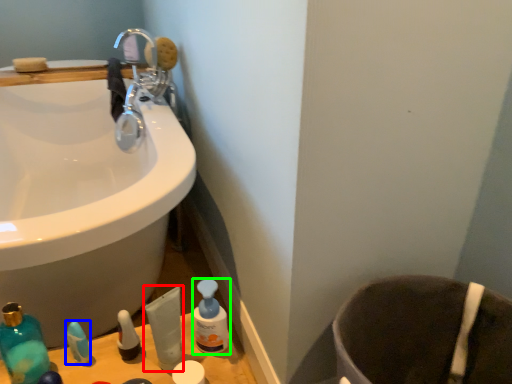
Question: Based on their relative distances, which object is nearer to toiletry (highlighted by a red box)? Choose from toiletry (highlighted by a blue box) and cleaning product (highlighted by a green box).

Choices:
 (A) toiletry
 (B) cleaning product

Answer: (B)